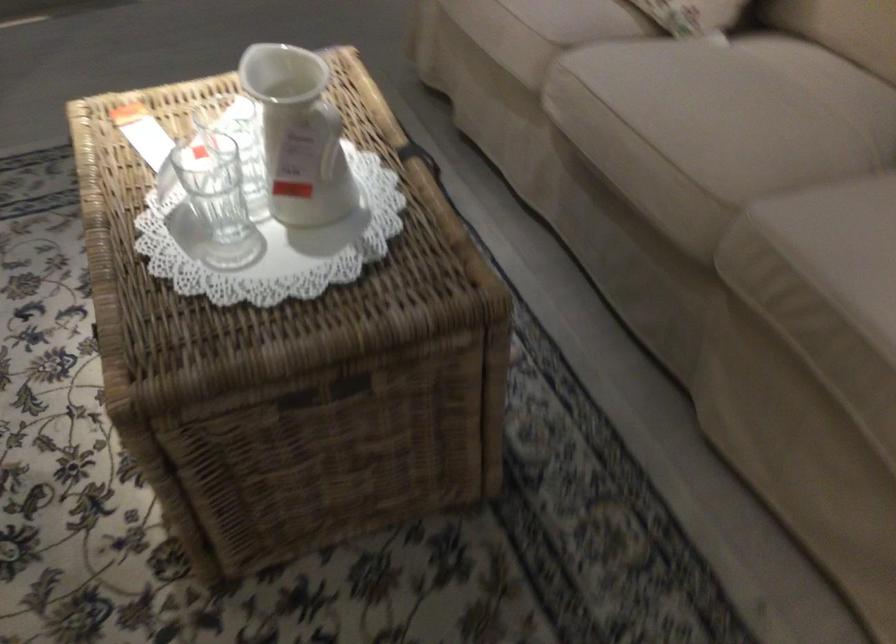
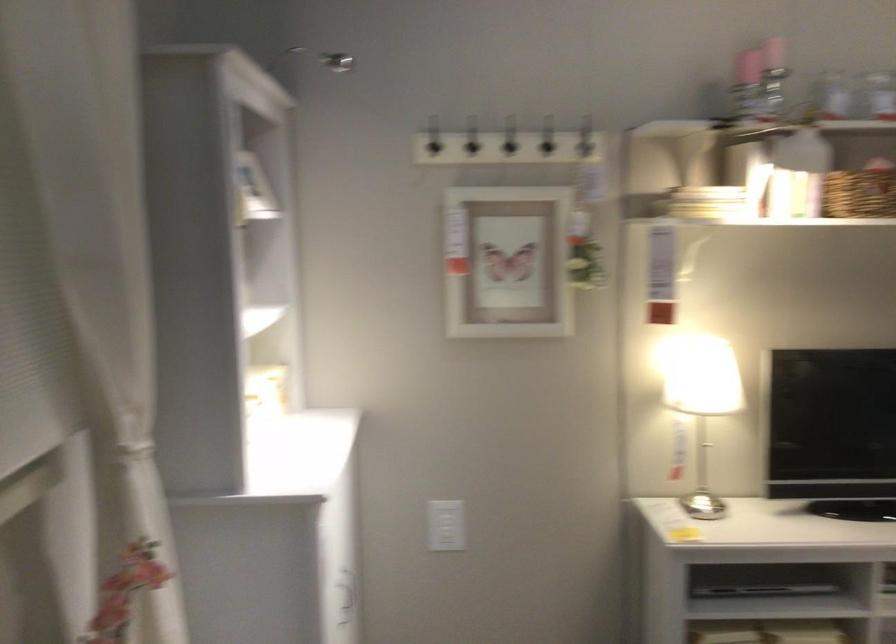
The first image is from the beginning of the video and the second image is from the end. How did the camera likely rotate when shooting the video?

The rotation direction of the camera is left-down.